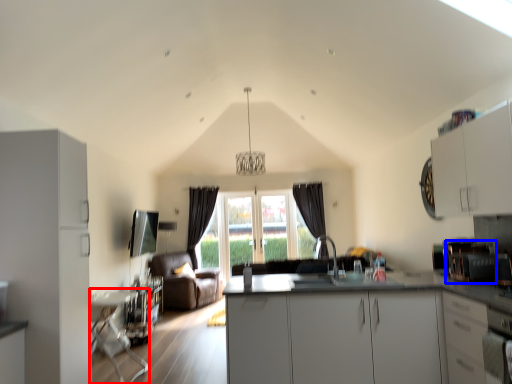
Question: Which object appears closest to the camera in this image, table (highlighted by a red box) or appliance (highlighted by a blue box)?

Choices:
 (A) table
 (B) appliance

Answer: (B)